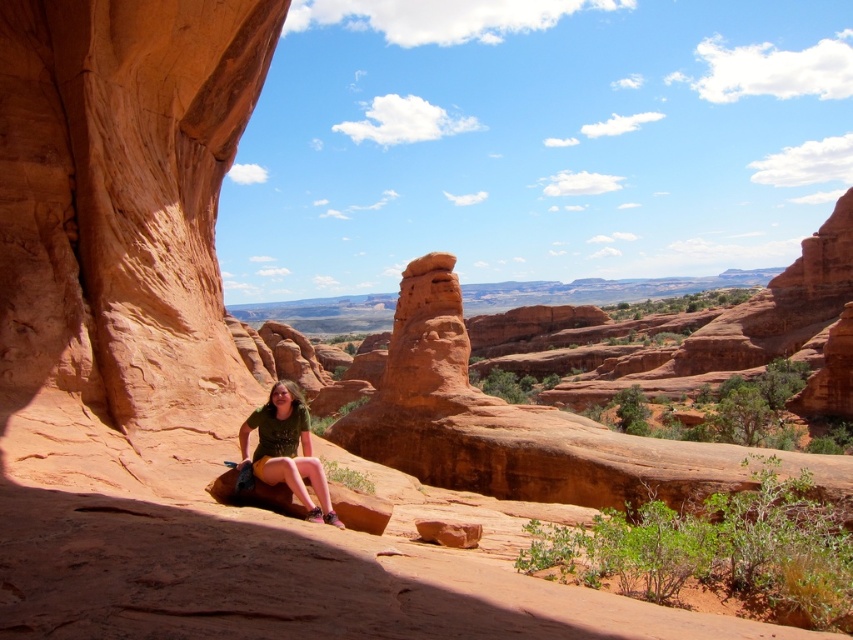
Question: Is green matte shorts at lower center positioned in front of reddish-brown rock at center?

Choices:
 (A) no
 (B) yes

Answer: (B)

Question: Is green matte shorts at lower center closer to camera compared to reddish-brown rock at center?

Choices:
 (A) no
 (B) yes

Answer: (B)

Question: Which point appears closest to the camera in this image?

Choices:
 (A) (457, 538)
 (B) (265, 460)

Answer: (B)

Question: Can you confirm if green matte shorts at lower center is smaller than reddish-brown rock at center?

Choices:
 (A) yes
 (B) no

Answer: (B)